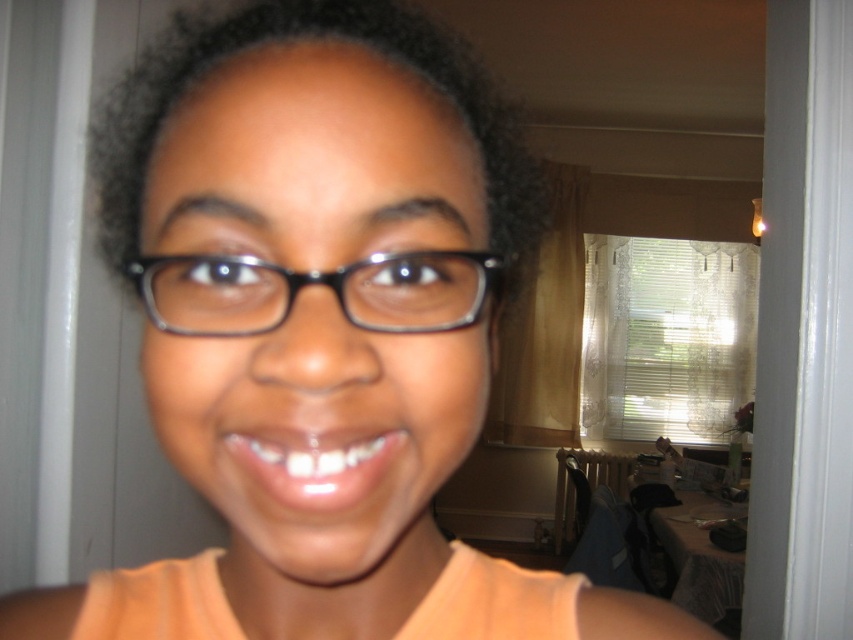
Question: Which point is farther from the camera taking this photo?

Choices:
 (A) (126, 196)
 (B) (461, 260)

Answer: (A)

Question: Among these objects, which one is nearest to the camera?

Choices:
 (A) black plastic glasses at center
 (B) dark curly hair at center

Answer: (A)

Question: Is the position of dark curly hair at center more distant than that of black plastic glasses at center?

Choices:
 (A) no
 (B) yes

Answer: (B)

Question: Which point appears farthest from the camera in this image?

Choices:
 (A) (225, 308)
 (B) (387, 4)

Answer: (B)

Question: Does dark curly hair at center have a larger size compared to black plastic glasses at center?

Choices:
 (A) no
 (B) yes

Answer: (B)

Question: Can you confirm if dark curly hair at center is positioned to the left of black plastic glasses at center?

Choices:
 (A) no
 (B) yes

Answer: (B)